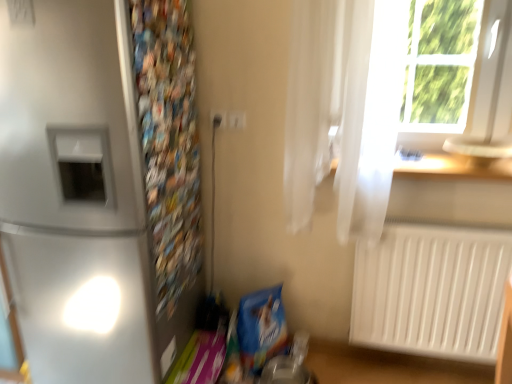
Locate an element on the screen. vacant space situated above wooden at upper right (from a real-world perspective) is located at coordinates (451, 162).